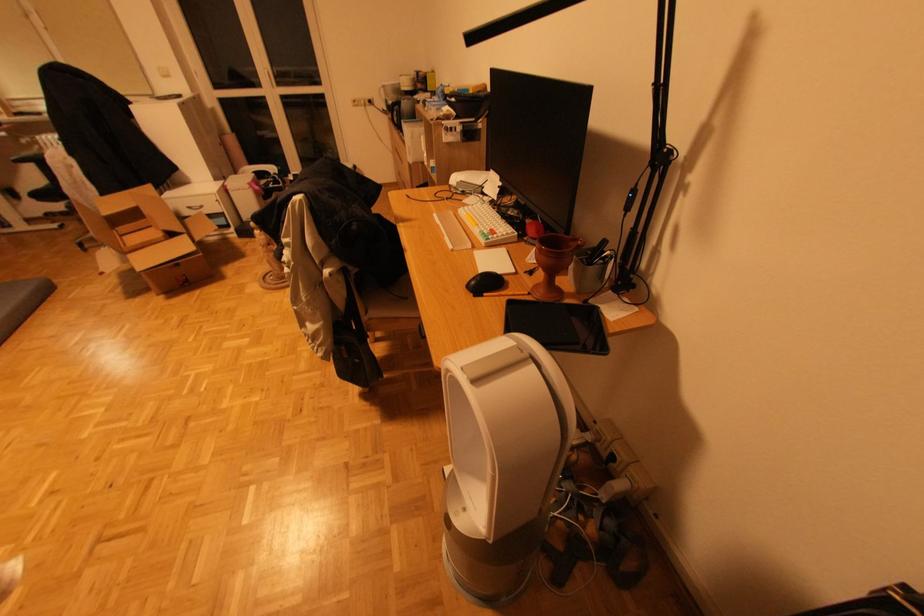
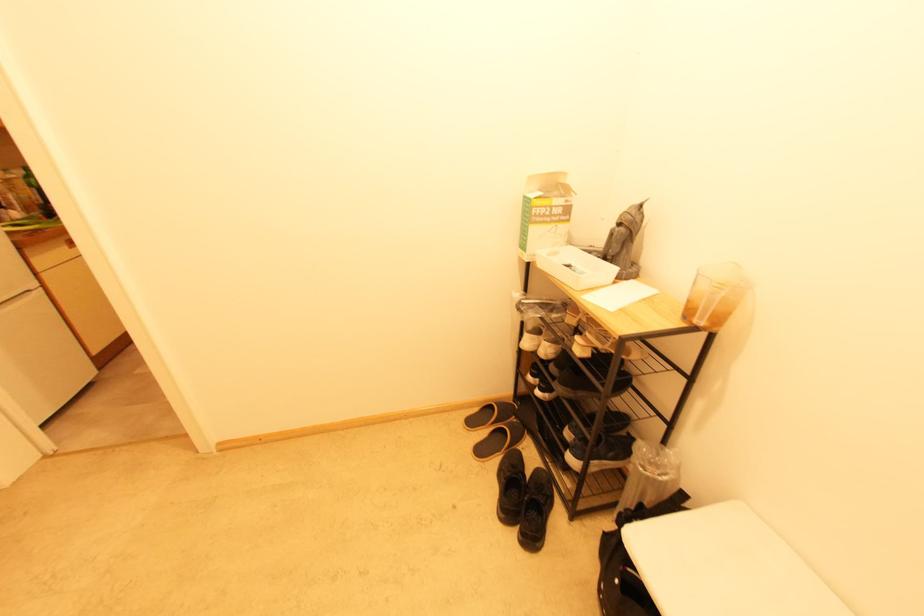
Question: I am providing you with two images of the same scene from different viewpoints. After the viewpoint changes to image2, which objects are now occluded?

Choices:
 (A) black bag strap
 (B) chrome chair armrest
 (C) black slipper
 (D) black sneaker

Answer: (A)